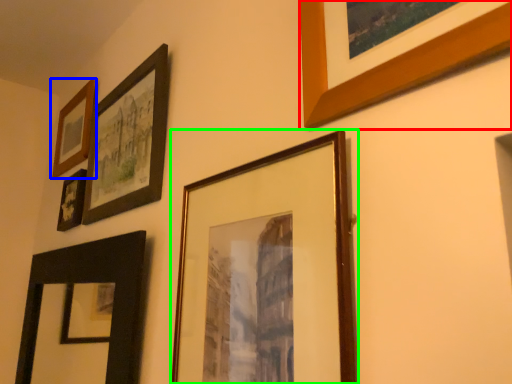
Question: Estimate the real-world distances between objects in this image. Which object is closer to picture frame (highlighted by a red box), picture frame (highlighted by a blue box) or picture frame (highlighted by a green box)?

Choices:
 (A) picture frame
 (B) picture frame

Answer: (B)